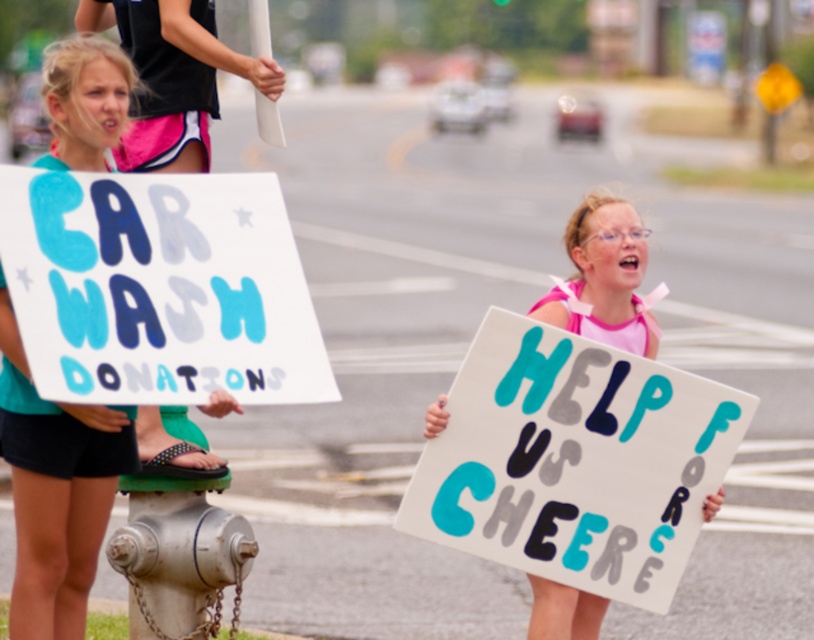
Based on the photo, who is higher up, teal fabric sign at left or pink fabric at center?

Positioned higher is pink fabric at center.

Which is behind, point (55, 150) or point (607, 253)?

The point (607, 253) is behind.

Measure the distance between teal fabric sign at left and camera.

They are 6.64 meters apart.

The width and height of the screenshot is (814, 640). Find the location of `teal fabric sign at left`. teal fabric sign at left is located at coordinates (55, 490).

Does hand-painted cardboard sign at left have a greater height compared to teal fabric sign at left?

No, hand-painted cardboard sign at left is not taller than teal fabric sign at left.

Measure the distance from hand-painted cardboard sign at left to teal fabric sign at left.

The distance of hand-painted cardboard sign at left from teal fabric sign at left is 21.01 inches.

Image resolution: width=814 pixels, height=640 pixels. I want to click on hand-painted cardboard sign at left, so click(x=160, y=289).

In order to click on hand-painted cardboard sign at left in this screenshot , I will do `click(160, 289)`.

The image size is (814, 640). Identify the location of hand-painted cardboard sign at left. (160, 289).

Can you confirm if hand-painted cardboard sign at left is positioned to the left of pink fabric at center?

Correct, you'll find hand-painted cardboard sign at left to the left of pink fabric at center.

Is point (23, 176) positioned in front of point (624, 264)?

Yes.

Image resolution: width=814 pixels, height=640 pixels. Find the location of `hand-painted cardboard sign at left`. hand-painted cardboard sign at left is located at coordinates (160, 289).